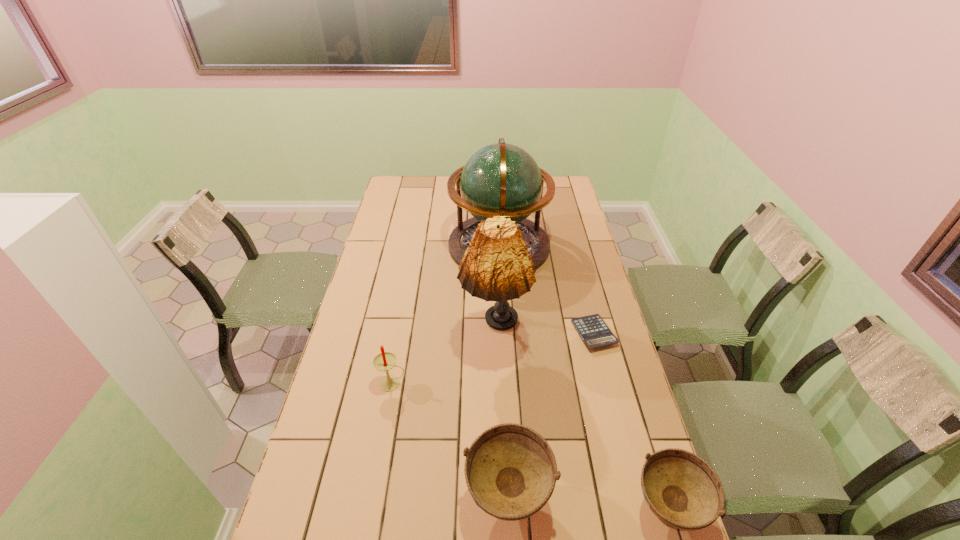
Locate an element on the screen. The height and width of the screenshot is (540, 960). free spot between the shortest object and the leftmost object is located at coordinates (493, 359).

Where is `unoccupied position between the shortest object and the lampshade`? unoccupied position between the shortest object and the lampshade is located at coordinates (544, 335).

I want to click on object that is the closest one to the left soup bowl, so click(x=681, y=489).

Identify the location of object that is the second closest to the globe. coord(593,330).

Where is `vacant region that satisfies the following two spatial constraints: 1. on the front-facing side of the globe; 2. on the front-facing side of the lampshade`? The image size is (960, 540). vacant region that satisfies the following two spatial constraints: 1. on the front-facing side of the globe; 2. on the front-facing side of the lampshade is located at coordinates (x=504, y=336).

Where is `free space in the image that satisfies the following two spatial constraints: 1. on the front-facing side of the globe; 2. on the back side of the calculator`? The width and height of the screenshot is (960, 540). free space in the image that satisfies the following two spatial constraints: 1. on the front-facing side of the globe; 2. on the back side of the calculator is located at coordinates (x=504, y=333).

At what (x,y) coordinates should I click in order to perform the action: click on vacant area that satisfies the following two spatial constraints: 1. on the front-facing side of the globe; 2. on the front-facing side of the lampshade. Please return your answer as a coordinate pair (x, y). The image size is (960, 540). Looking at the image, I should click on (504, 336).

Locate an element on the screen. This screenshot has width=960, height=540. free region that satisfies the following two spatial constraints: 1. on the front-facing side of the calculator; 2. on the left side of the farthest object is located at coordinates (504, 333).